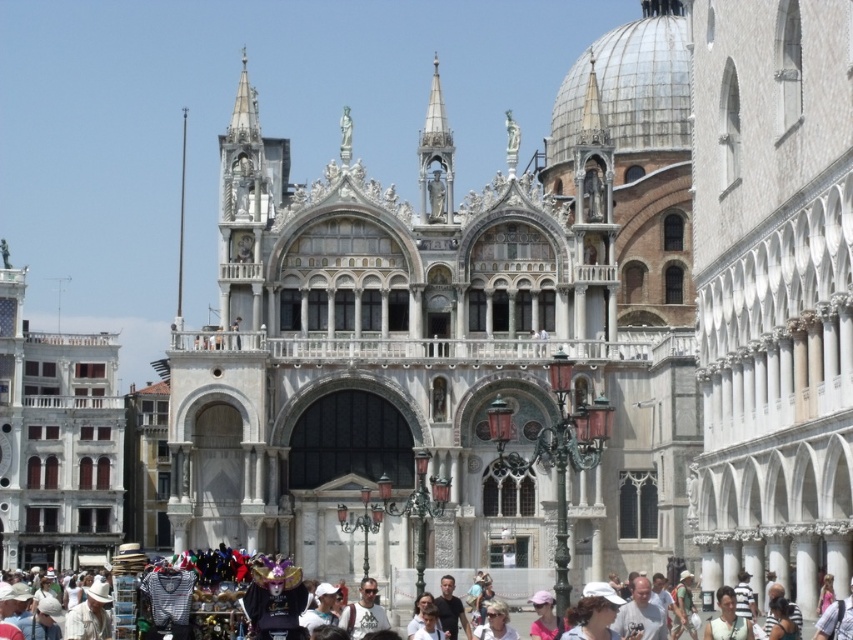
Question: Can you confirm if white marble palace at center is positioned to the right of white marble building at left?

Choices:
 (A) yes
 (B) no

Answer: (A)

Question: Observing the image, what is the correct spatial positioning of white marble building at left in reference to white cotton hats at lower center?

Choices:
 (A) left
 (B) right

Answer: (A)

Question: Where is white marble building at left located in relation to white cotton hats at lower center in the image?

Choices:
 (A) left
 (B) right

Answer: (A)

Question: Among these points, which one is farthest from the camera?

Choices:
 (A) (28, 516)
 (B) (572, 560)

Answer: (A)

Question: Which is farther from the white marble palace at center?

Choices:
 (A) white marble building at left
 (B) white cotton hats at lower center

Answer: (A)

Question: Among these objects, which one is farthest from the camera?

Choices:
 (A) white cotton hats at lower center
 (B) white marble building at left
 (C) white marble palace at center

Answer: (B)